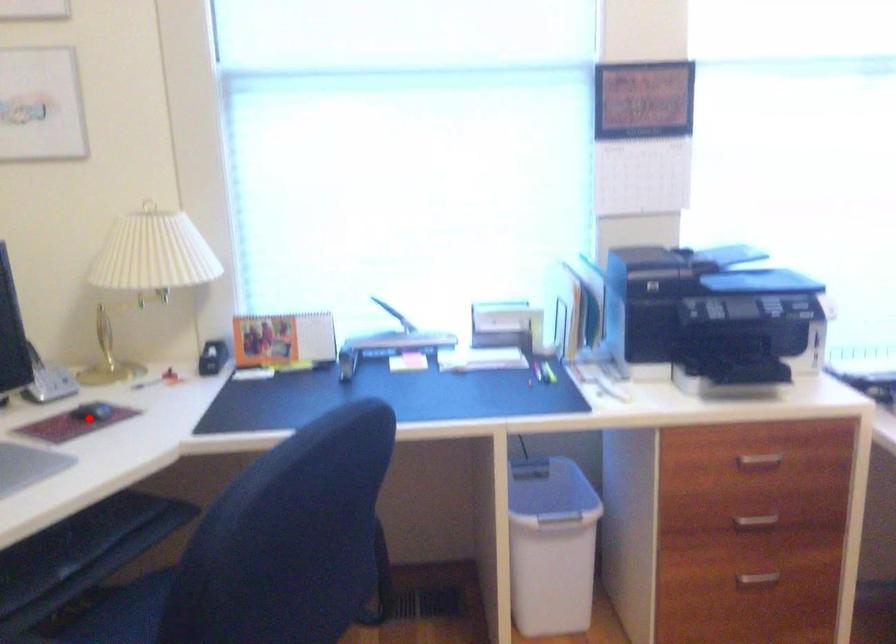
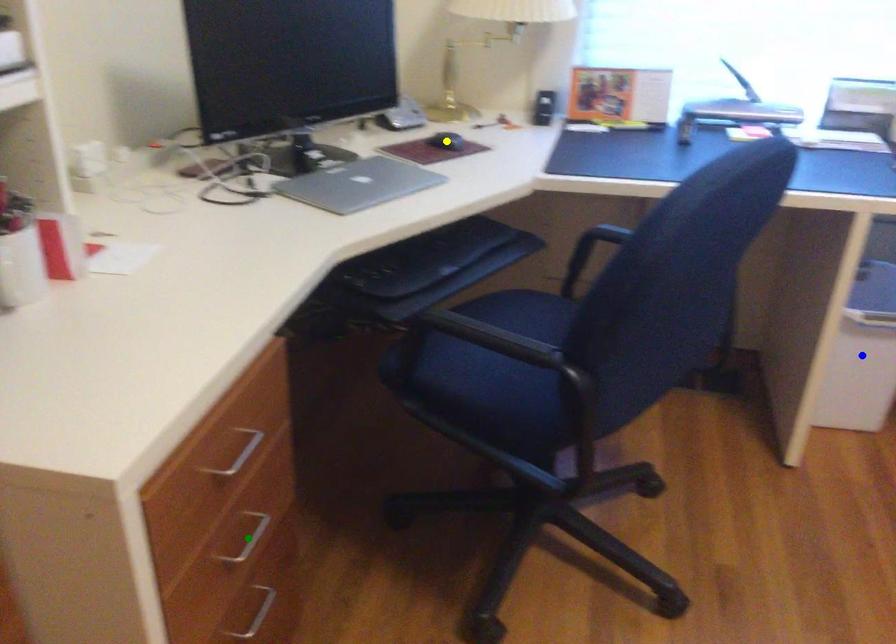
Question: I am providing you with two images of the same scene from different viewpoints. A red point is marked on the first image. You are given multiple points on the second image. Which mark in image 2 goes with the point in image 1?

Choices:
 (A) green point
 (B) yellow point
 (C) blue point

Answer: (B)